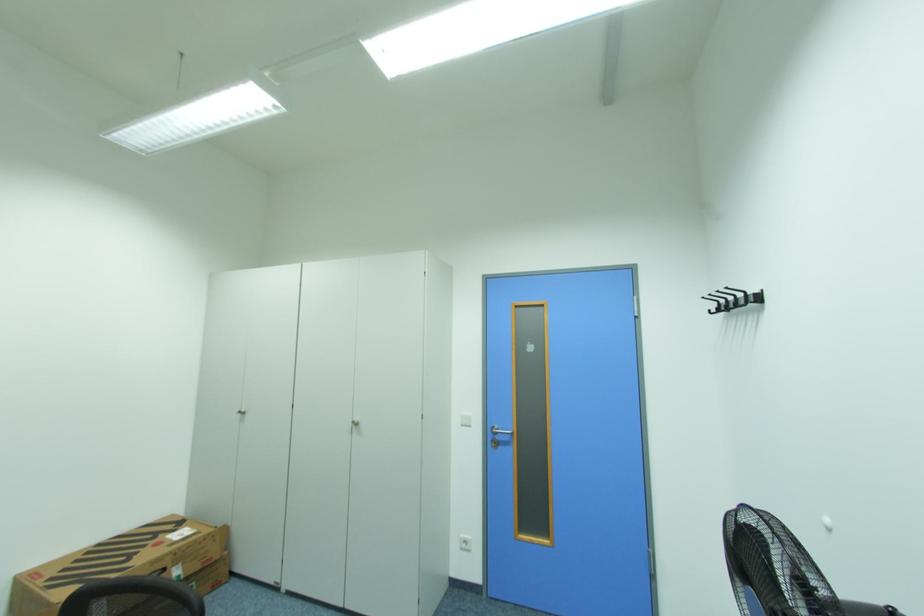
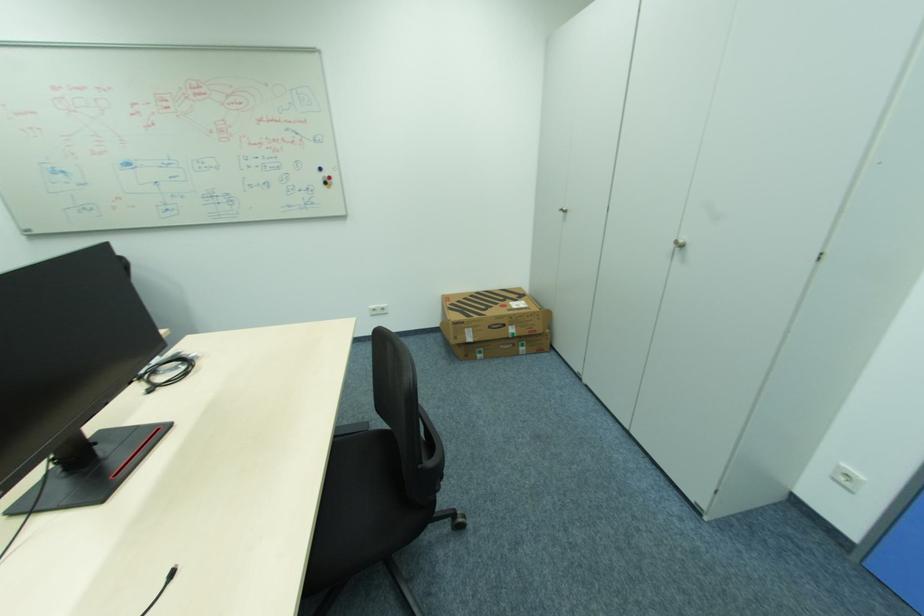
Find the pixel in the second image that matches point 359,422 in the first image.

(679, 243)